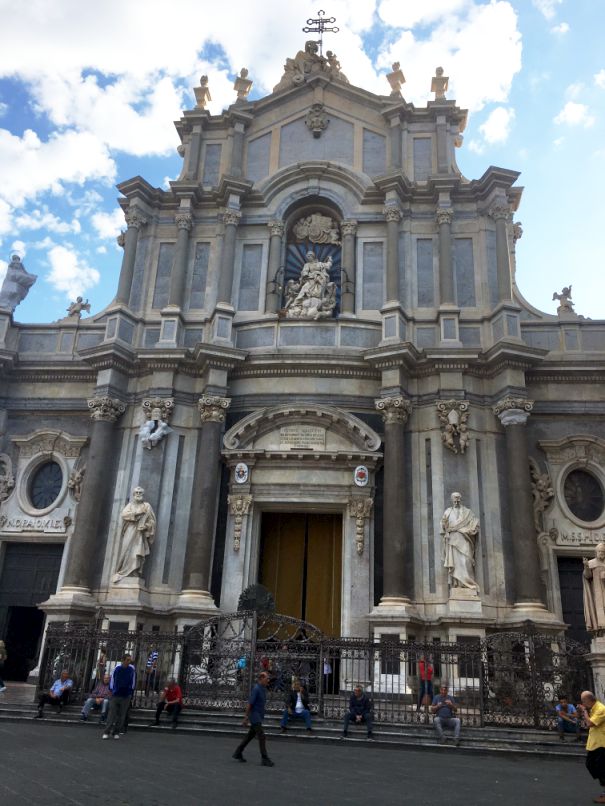
Where is `statue on right`? statue on right is located at coordinates (462, 533).